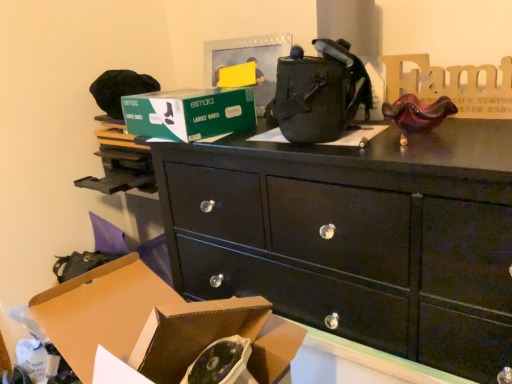
Question: Is black glossy chest of drawers at center facing away from green cardboard box at upper center, which is the 1th box from top to bottom?

Choices:
 (A) yes
 (B) no

Answer: (B)

Question: From a real-world perspective, is black glossy chest of drawers at center physically above green cardboard box at upper center, the second box when ordered from bottom to top?

Choices:
 (A) no
 (B) yes

Answer: (A)

Question: Can you confirm if black glossy chest of drawers at center is shorter than green cardboard box at upper center, the second box when ordered from bottom to top?

Choices:
 (A) yes
 (B) no

Answer: (B)

Question: Is black glossy chest of drawers at center touching green cardboard box at upper center, arranged as the 1th box when viewed from the back?

Choices:
 (A) yes
 (B) no

Answer: (B)

Question: Is black glossy chest of drawers at center not near green cardboard box at upper center, the second box when ordered from bottom to top?

Choices:
 (A) yes
 (B) no

Answer: (B)

Question: Is point (146, 296) positioned closer to the camera than point (266, 158)?

Choices:
 (A) farther
 (B) closer

Answer: (B)

Question: Looking at the image, does brown cardboard box at lower left, the first box in the bottom-to-top sequence, seem bigger or smaller compared to black glossy chest of drawers at center?

Choices:
 (A) big
 (B) small

Answer: (B)

Question: From the image's perspective, is brown cardboard box at lower left, which is the 2th box from back to front, positioned above or below black glossy chest of drawers at center?

Choices:
 (A) above
 (B) below

Answer: (B)

Question: In the image, is brown cardboard box at lower left, which is the 2th box from back to front, positioned in front of or behind black glossy chest of drawers at center?

Choices:
 (A) front
 (B) behind

Answer: (A)

Question: Is green cardboard box at upper center, arranged as the 1th box when viewed from the back, situated inside black glossy chest of drawers at center or outside?

Choices:
 (A) outside
 (B) inside

Answer: (A)

Question: Visually, is green cardboard box at upper center, the second box when ordered from bottom to top, positioned to the left or to the right of black glossy chest of drawers at center?

Choices:
 (A) right
 (B) left

Answer: (B)

Question: Is point (142, 119) positioned closer to the camera than point (224, 271)?

Choices:
 (A) farther
 (B) closer

Answer: (A)

Question: Based on their sizes in the image, would you say green cardboard box at upper center, arranged as the 1th box when viewed from the back, is bigger or smaller than black glossy chest of drawers at center?

Choices:
 (A) big
 (B) small

Answer: (B)

Question: Considering the positions of point 303,203 and point 177,127, is point 303,203 closer or farther from the camera than point 177,127?

Choices:
 (A) closer
 (B) farther

Answer: (A)

Question: Based on their sizes in the image, would you say black glossy chest of drawers at center is bigger or smaller than green cardboard box at upper center, arranged as the 1th box when viewed from the back?

Choices:
 (A) big
 (B) small

Answer: (A)